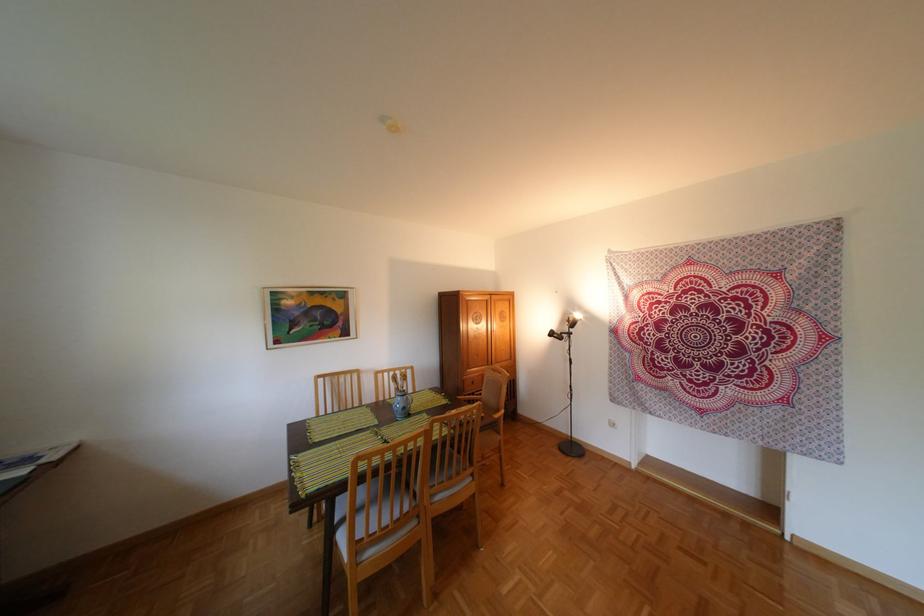
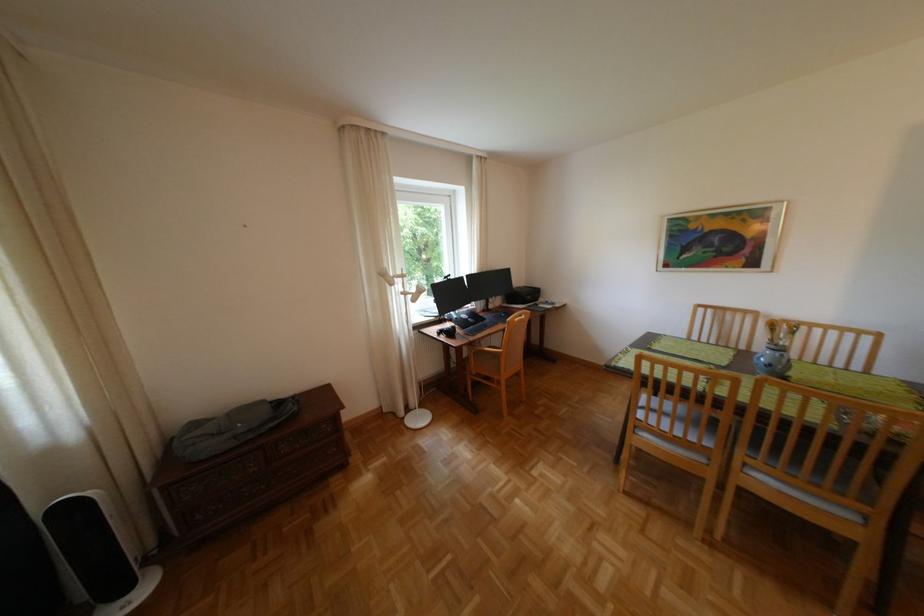
Question: The images are taken continuously from a first-person perspective. In which direction is your viewpoint rotating?

Choices:
 (A) Left
 (B) Right
 (C) Up
 (D) Down

Answer: (A)